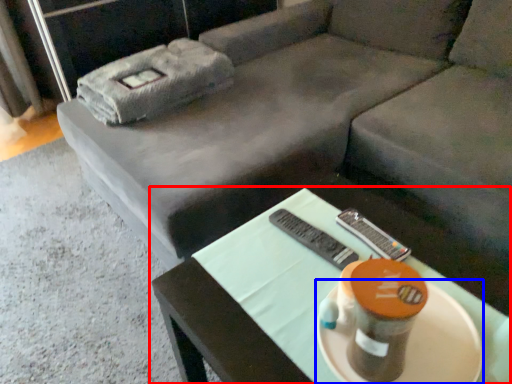
Question: Which point is closer to the camera, table (highlighted by a red box) or platter (highlighted by a blue box)?

Choices:
 (A) table
 (B) platter

Answer: (A)